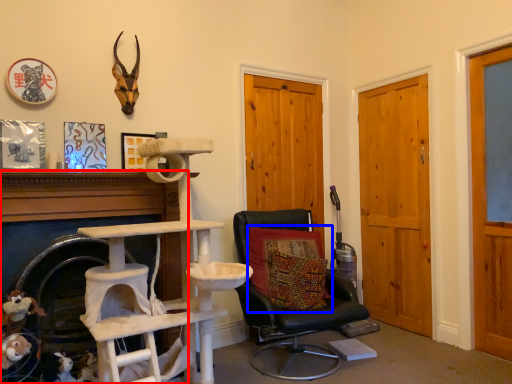
Question: Which of the following is the closest to the observer, fireplace (highlighted by a red box) or pillow (highlighted by a blue box)?

Choices:
 (A) fireplace
 (B) pillow

Answer: (A)